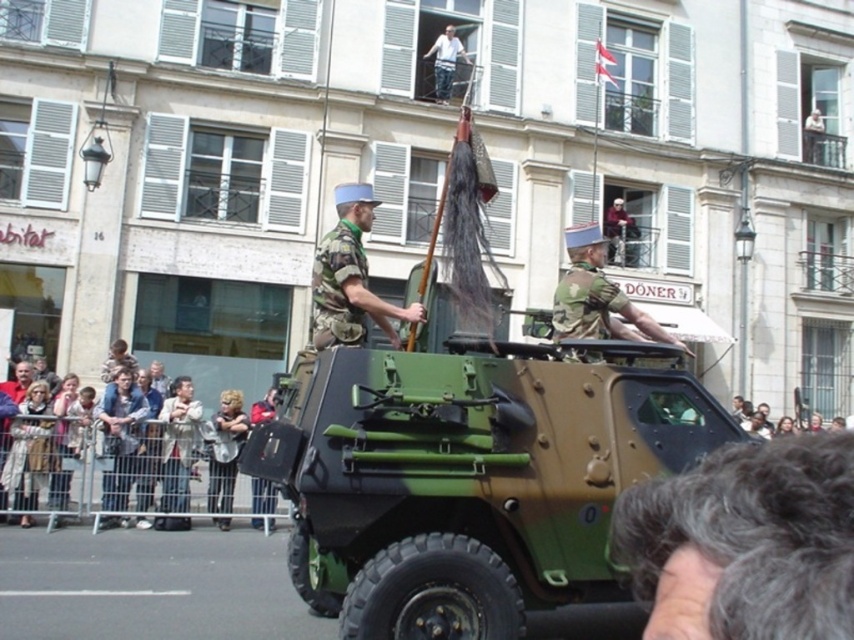
Question: Is gray curly hair at lower right bigger than camouflage uniform at center?

Choices:
 (A) no
 (B) yes

Answer: (B)

Question: Which object is closer to the camera taking this photo?

Choices:
 (A) gray curly hair at lower right
 (B) striped fabric jacket at lower left
 (C) camouflage uniform at center
 (D) camouflage fabric uniform at center

Answer: (A)

Question: Does light brown wooden fence at lower left lie in front of white cotton shirt at upper center?

Choices:
 (A) no
 (B) yes

Answer: (B)

Question: Which point is farther to the camera?

Choices:
 (A) (574, 326)
 (B) (722, 540)
 (C) (235, 362)

Answer: (C)

Question: Estimate the real-world distances between objects in this image. Which object is closer to the white cotton shirt at upper center?

Choices:
 (A) striped fabric jacket at lower left
 (B) camouflage uniform at center
 (C) gray curly hair at lower right

Answer: (A)

Question: Observing the image, what is the correct spatial positioning of camouflage fabric uniform at center in reference to white cotton shirt at upper center?

Choices:
 (A) right
 (B) left

Answer: (B)